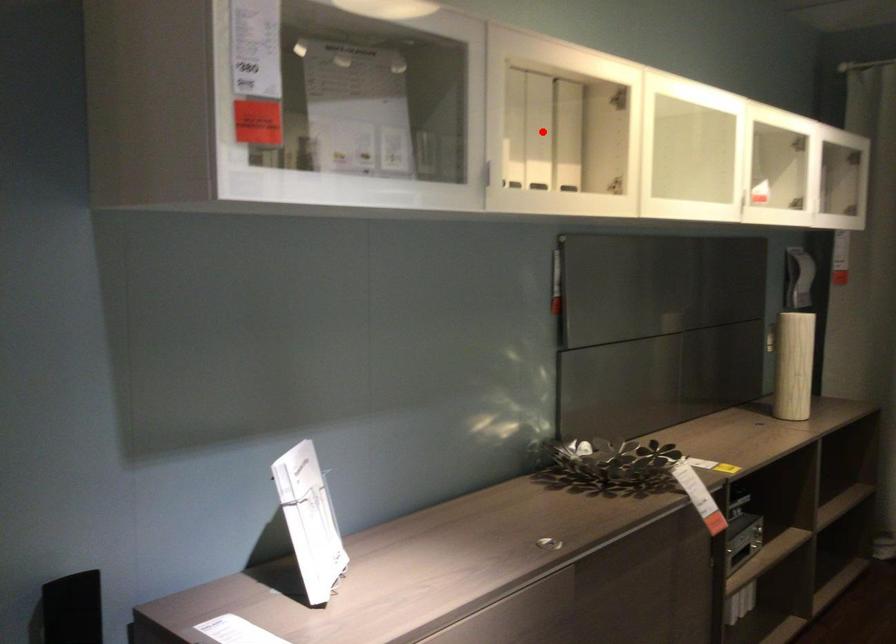
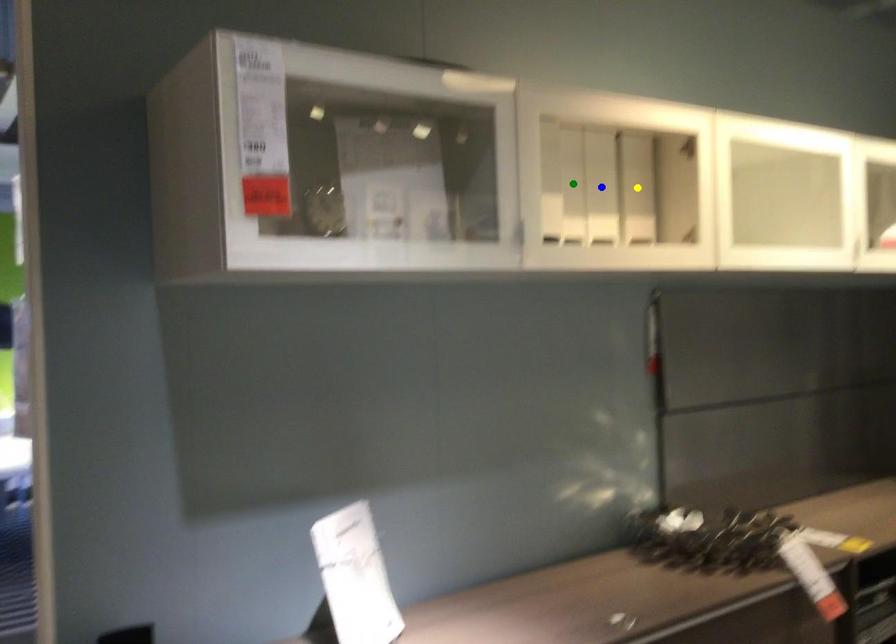
Question: I am providing you with two images of the same scene from different viewpoints. A red point is marked on the first image. You are given multiple points on the second image. Which point in image 2 represents the same 3d spot as the red point in image 1?

Choices:
 (A) green point
 (B) blue point
 (C) yellow point

Answer: (B)